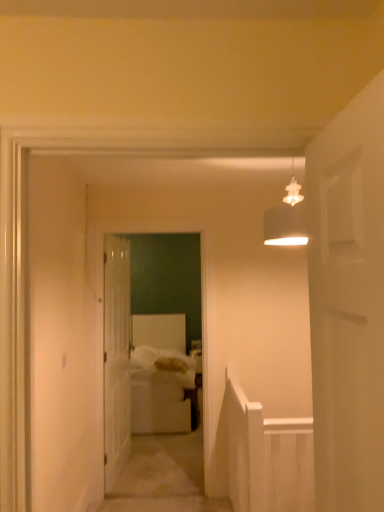
Question: Is white soft bed at center to the left or to the right of white soft bed at center in the image?

Choices:
 (A) left
 (B) right

Answer: (A)

Question: From a real-world perspective, is white soft bed at center above or below white soft bed at center?

Choices:
 (A) below
 (B) above

Answer: (B)

Question: Which is nearer to the white fabric bed at center?

Choices:
 (A) white soft bed at center
 (B) white soft bedsheet at center
 (C) white soft bed at center
 (D) matte white lampshade at upper center
 (E) white glossy door at center

Answer: (E)

Question: Considering the real-world distances, which object is closest to the matte white lampshade at upper center?

Choices:
 (A) white soft bed at center
 (B) white fabric bed at center
 (C) white soft bedsheet at center
 (D) white soft bed at center
 (E) white glossy door at center

Answer: (B)